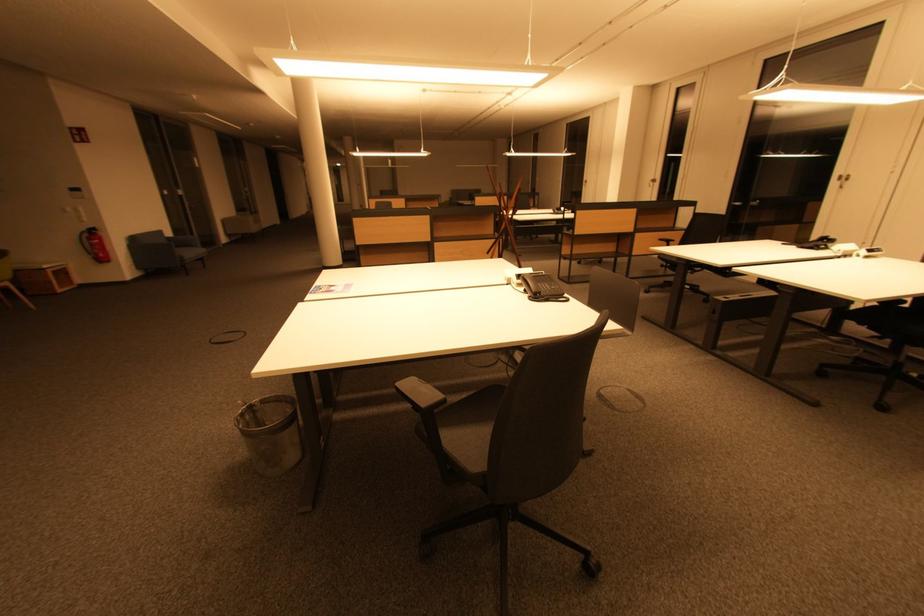
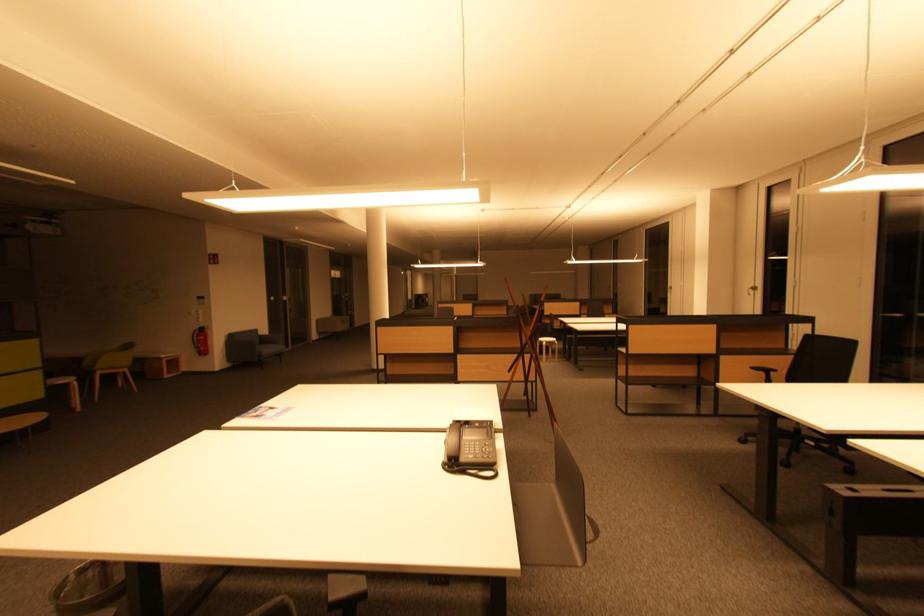
Locate, in the second image, the point that corresponds to point (138, 241) in the first image.

(236, 339)